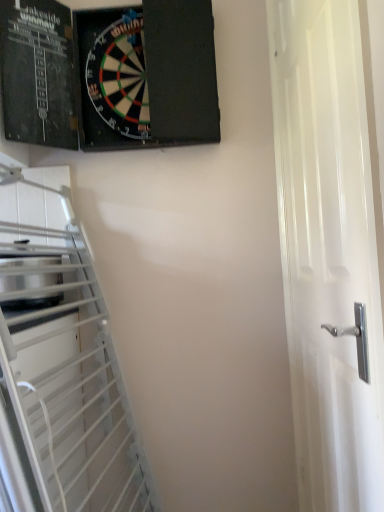
Question: Is black matte dartboard at upper left facing towards white glossy door at right?

Choices:
 (A) no
 (B) yes

Answer: (A)

Question: Is black matte dartboard at upper left shorter than white glossy door at right?

Choices:
 (A) yes
 (B) no

Answer: (A)

Question: Is black matte dartboard at upper left thinner than white glossy door at right?

Choices:
 (A) yes
 (B) no

Answer: (B)

Question: Does black matte dartboard at upper left have a greater width compared to white glossy door at right?

Choices:
 (A) yes
 (B) no

Answer: (A)

Question: Is black matte dartboard at upper left far from white glossy door at right?

Choices:
 (A) yes
 (B) no

Answer: (B)

Question: Does black matte dartboard at upper left have a larger size compared to white glossy door at right?

Choices:
 (A) yes
 (B) no

Answer: (B)

Question: Can you confirm if white glossy door at right is wider than black matte dartboard at upper left?

Choices:
 (A) yes
 (B) no

Answer: (B)

Question: From a real-world perspective, is white glossy door at right positioned under black matte dartboard at upper left based on gravity?

Choices:
 (A) no
 (B) yes

Answer: (B)

Question: Is white glossy door at right looking in the opposite direction of black matte dartboard at upper left?

Choices:
 (A) yes
 (B) no

Answer: (B)

Question: Is white glossy door at right bigger than black matte dartboard at upper left?

Choices:
 (A) yes
 (B) no

Answer: (A)

Question: Is white glossy door at right aimed at black matte dartboard at upper left?

Choices:
 (A) yes
 (B) no

Answer: (A)

Question: Is white glossy door at right thinner than black matte dartboard at upper left?

Choices:
 (A) no
 (B) yes

Answer: (B)

Question: From the image's perspective, is white glossy door at right above or below black matte dartboard at upper left?

Choices:
 (A) above
 (B) below

Answer: (B)